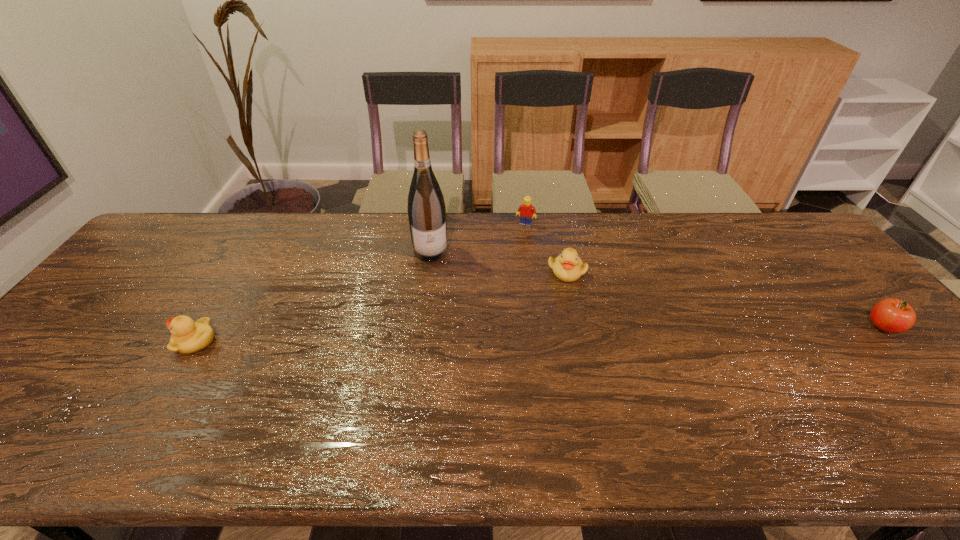
In order to click on the leftmost object in this screenshot , I will do `click(187, 337)`.

This screenshot has height=540, width=960. Identify the location of the nearer duckling. (187, 337).

I want to click on the rightmost object, so click(x=890, y=315).

This screenshot has width=960, height=540. I want to click on the fourth object from right to left, so click(x=426, y=207).

In order to click on the tallest object in this screenshot , I will do `click(426, 207)`.

At what (x,y) coordinates should I click in order to perform the action: click on the second object from right to left. Please return your answer as a coordinate pair (x, y). Looking at the image, I should click on (568, 267).

You are a GUI agent. You are given a task and a screenshot of the screen. Output one action in this format:
    pyautogui.click(x=<x>, y=<y>)
    Task: Click on the farther duckling
    
    Given the screenshot: What is the action you would take?
    pyautogui.click(x=568, y=267)

Locate an element on the screen. This screenshot has width=960, height=540. Lego is located at coordinates (525, 211).

Where is `the third object from left to right`? This screenshot has width=960, height=540. the third object from left to right is located at coordinates (525, 211).

Locate an element on the screen. This screenshot has width=960, height=540. vacant space situated at the face of the nearer duckling is located at coordinates (155, 341).